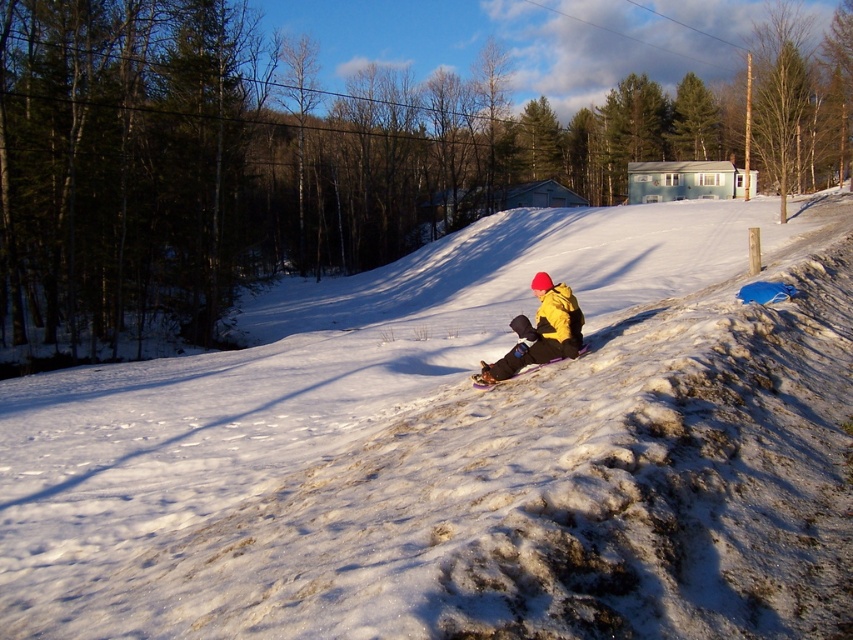
Is point (622, 564) behind point (483, 387)?

No.

Find the location of a particular element. white fluffy snow at center is located at coordinates (462, 449).

The height and width of the screenshot is (640, 853). In order to click on white fluffy snow at center in this screenshot , I will do `click(462, 449)`.

Is yellow matte jacket at center positioned at the back of purple plastic snowboard at center?

No, yellow matte jacket at center is in front of purple plastic snowboard at center.

Is yellow matte jacket at center smaller than purple plastic snowboard at center?

No, yellow matte jacket at center is not smaller than purple plastic snowboard at center.

Which is in front, point (543, 330) or point (531, 365)?

Point (543, 330) is more forward.

Find the location of `yellow matte jacket at center`. yellow matte jacket at center is located at coordinates (540, 332).

Which is below, white fluffy snow at center or yellow matte jacket at center?

yellow matte jacket at center

What do you see at coordinates (462, 449) in the screenshot?
I see `white fluffy snow at center` at bounding box center [462, 449].

The image size is (853, 640). What do you see at coordinates (462, 449) in the screenshot?
I see `white fluffy snow at center` at bounding box center [462, 449].

The height and width of the screenshot is (640, 853). In order to click on white fluffy snow at center in this screenshot , I will do `click(462, 449)`.